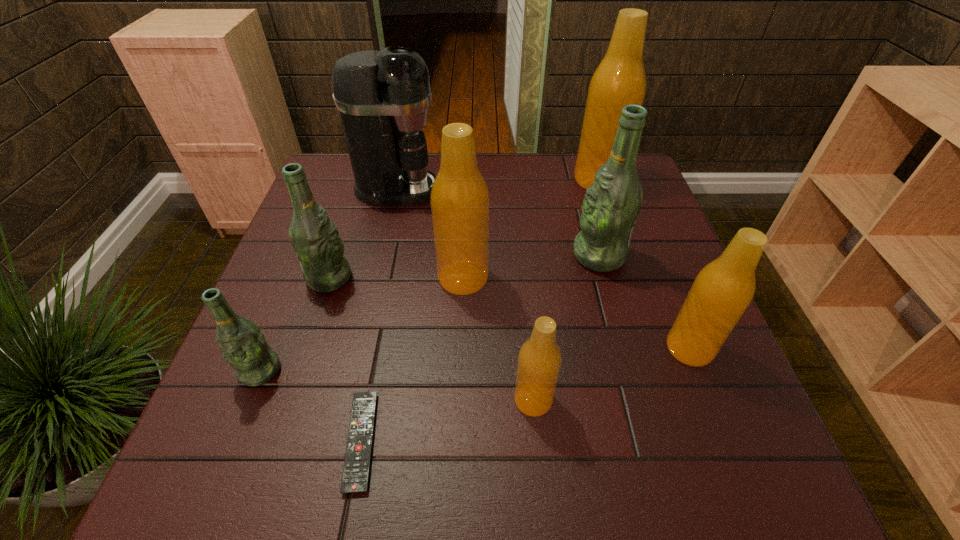
You are a GUI agent. You are given a task and a screenshot of the screen. Output one action in this format:
    pyautogui.click(x=<x>, y=<y>)
    Task: Click on the smallest green beer bottle
    
    Given the screenshot: What is the action you would take?
    pyautogui.click(x=239, y=339)

Locate an element on the screen. remote control is located at coordinates (355, 476).

The width and height of the screenshot is (960, 540). In order to click on free space located on the front of the biggest tan beer bottle in this screenshot , I will do `click(617, 240)`.

This screenshot has height=540, width=960. I want to click on vacant space located 0.350m place cup under the spout of the coffee maker, so click(561, 189).

In order to click on vacant area situated on the surface of the biggest green beer bottle in this screenshot , I will do `click(439, 255)`.

Locate an element on the screen. vacant space situated 0.080m on the surface of the biggest green beer bottle is located at coordinates (540, 255).

Image resolution: width=960 pixels, height=540 pixels. I want to click on free space located on the surface of the biggest green beer bottle, so click(x=487, y=255).

This screenshot has height=540, width=960. I want to click on vacant region located 0.160m on the left of the fifth object from right to left, so click(x=370, y=278).

Where is `vacant space situated on the surface of the second biggest green beer bottle`? Image resolution: width=960 pixels, height=540 pixels. vacant space situated on the surface of the second biggest green beer bottle is located at coordinates (489, 278).

I want to click on free space located on the left of the third farthest tan beer bottle, so click(622, 348).